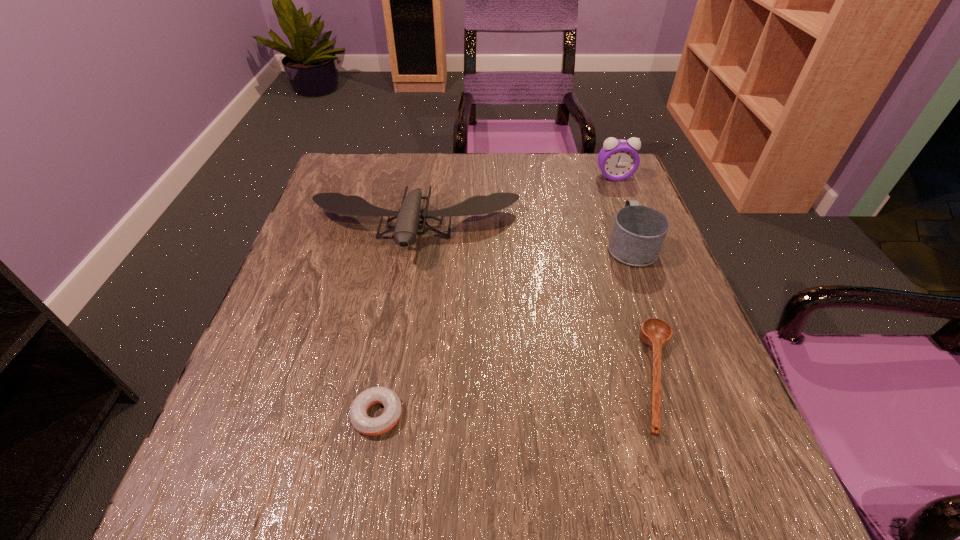
Find the location of a particular element. This screenshot has height=540, width=960. object located at the far right corner is located at coordinates (618, 160).

Where is `vacant space at the far edge`? vacant space at the far edge is located at coordinates (453, 158).

In the image, there is a desktop. What are the coordinates of `vacant space at the near edge` in the screenshot? It's located at (393, 497).

You are a GUI agent. You are given a task and a screenshot of the screen. Output one action in this format:
    pyautogui.click(x=<x>, y=<y>)
    Task: Click on the vacant space at the left edge of the desktop
    Image resolution: width=960 pixels, height=540 pixels.
    Given the screenshot: What is the action you would take?
    pyautogui.click(x=277, y=435)

Image resolution: width=960 pixels, height=540 pixels. I want to click on vacant point at the right edge, so click(668, 379).

In the image, there is a desktop. What are the coordinates of `vacant space at the far left corner` in the screenshot? It's located at (375, 165).

At what (x,y) coordinates should I click in order to perform the action: click on free space at the far right corner. Please return your answer as a coordinate pair (x, y). The image size is (960, 540). Looking at the image, I should click on (578, 179).

The height and width of the screenshot is (540, 960). In order to click on free point between the doughnut and the mug in this screenshot , I will do 504,330.

The width and height of the screenshot is (960, 540). I want to click on vacant space that's between the mug and the doughnut, so click(x=504, y=330).

You are a GUI agent. You are given a task and a screenshot of the screen. Output one action in this format:
    pyautogui.click(x=<x>, y=<y>)
    Task: Click on the vacant space that's between the drone and the doughnut
    Image resolution: width=960 pixels, height=540 pixels.
    Given the screenshot: What is the action you would take?
    coord(396,322)